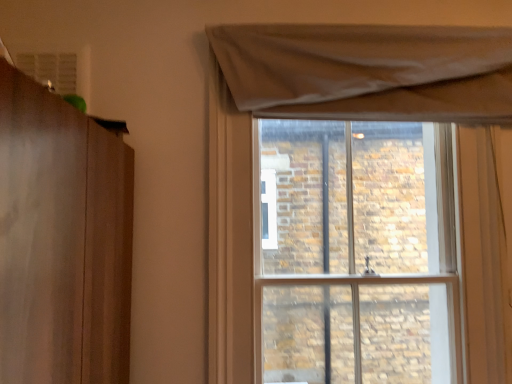
The image size is (512, 384). Find the location of `brown stone wall at upper center`. brown stone wall at upper center is located at coordinates (357, 253).

In order to face brown stone wall at upper center, should I rotate leftwards or rightwards?

A 11.779 degree turn to the right will do.

Measure the distance between brown stone wall at upper center and camera.

brown stone wall at upper center is 4.39 feet away from camera.

What do you see at coordinates (357, 253) in the screenshot? I see `brown stone wall at upper center` at bounding box center [357, 253].

This screenshot has width=512, height=384. What do you see at coordinates (323, 118) in the screenshot?
I see `matte beige curtain at upper right` at bounding box center [323, 118].

Where is `matte beige curtain at upper right`? Image resolution: width=512 pixels, height=384 pixels. matte beige curtain at upper right is located at coordinates (323, 118).

The width and height of the screenshot is (512, 384). In order to click on brown stone wall at upper center in this screenshot , I will do `click(357, 253)`.

Between brown stone wall at upper center and matte beige curtain at upper right, which one appears on the left side from the viewer's perspective?

matte beige curtain at upper right.

Is the position of brown stone wall at upper center more distant than that of matte beige curtain at upper right?

That is True.

Considering the positions of point (336, 133) and point (339, 93), is point (336, 133) closer or farther from the camera than point (339, 93)?

Point (336, 133) appears to be farther away from the viewer than point (339, 93).

From the image's perspective, which is below, brown stone wall at upper center or matte beige curtain at upper right?

brown stone wall at upper center is shown below in the image.

Looking at this image, from a real-world perspective, is brown stone wall at upper center above or below matte beige curtain at upper right?

From a real-world perspective, brown stone wall at upper center is physically below matte beige curtain at upper right.

Is brown stone wall at upper center wider than matte beige curtain at upper right?

Yes, brown stone wall at upper center is wider than matte beige curtain at upper right.

Is brown stone wall at upper center shorter than matte beige curtain at upper right?

No, brown stone wall at upper center is not shorter than matte beige curtain at upper right.

Is brown stone wall at upper center bigger or smaller than matte beige curtain at upper right?

Considering their sizes, brown stone wall at upper center takes up more space than matte beige curtain at upper right.

Is matte beige curtain at upper right a part of brown stone wall at upper center?

No.

Is brown stone wall at upper center not close to matte beige curtain at upper right?

No.

Is brown stone wall at upper center aimed at matte beige curtain at upper right?

Yes, brown stone wall at upper center is aimed at matte beige curtain at upper right.

How different are the orientations of brown stone wall at upper center and matte beige curtain at upper right in degrees?

They differ by 0.606 degrees in their facing directions.

Where is `window screen on the right of matte beige curtain at upper right`? window screen on the right of matte beige curtain at upper right is located at coordinates (357, 253).

Which object is positioned more to the left, matte beige curtain at upper right or brown stone wall at upper center?

matte beige curtain at upper right.

Consider the image. Between matte beige curtain at upper right and brown stone wall at upper center, which one is positioned in front?

matte beige curtain at upper right.

Is point (362, 114) closer or farther from the camera than point (265, 177)?

Point (362, 114).

From the image's perspective, is matte beige curtain at upper right below brown stone wall at upper center?

No, from the image's perspective, matte beige curtain at upper right is not beneath brown stone wall at upper center.

From a real-world perspective, is matte beige curtain at upper right positioned above or below brown stone wall at upper center?

In terms of real-world spatial position, matte beige curtain at upper right is above brown stone wall at upper center.

Which object is thinner, matte beige curtain at upper right or brown stone wall at upper center?

Thinner between the two is matte beige curtain at upper right.

Between matte beige curtain at upper right and brown stone wall at upper center, which one has more height?

brown stone wall at upper center is taller.

Considering the sizes of objects matte beige curtain at upper right and brown stone wall at upper center in the image provided, who is bigger, matte beige curtain at upper right or brown stone wall at upper center?

brown stone wall at upper center.

Do you think matte beige curtain at upper right is within brown stone wall at upper center, or outside of it?

matte beige curtain at upper right is not enclosed by brown stone wall at upper center.

Is matte beige curtain at upper right with brown stone wall at upper center?

No, matte beige curtain at upper right is not with brown stone wall at upper center.

Is matte beige curtain at upper right facing away from brown stone wall at upper center?

Correct, matte beige curtain at upper right is looking away from brown stone wall at upper center.

Can you tell me how much matte beige curtain at upper right and brown stone wall at upper center differ in facing direction?

The facing directions of matte beige curtain at upper right and brown stone wall at upper center are 0.606 degrees apart.

Where is `window screen below the matte beige curtain at upper right (from the image's perspective)`? window screen below the matte beige curtain at upper right (from the image's perspective) is located at coordinates (357, 253).

The width and height of the screenshot is (512, 384). I want to click on window lying on the left of brown stone wall at upper center, so click(x=323, y=118).

Image resolution: width=512 pixels, height=384 pixels. In the image, there is a brown stone wall at upper center. In order to click on window above it (from the image's perspective) in this screenshot , I will do `click(323, 118)`.